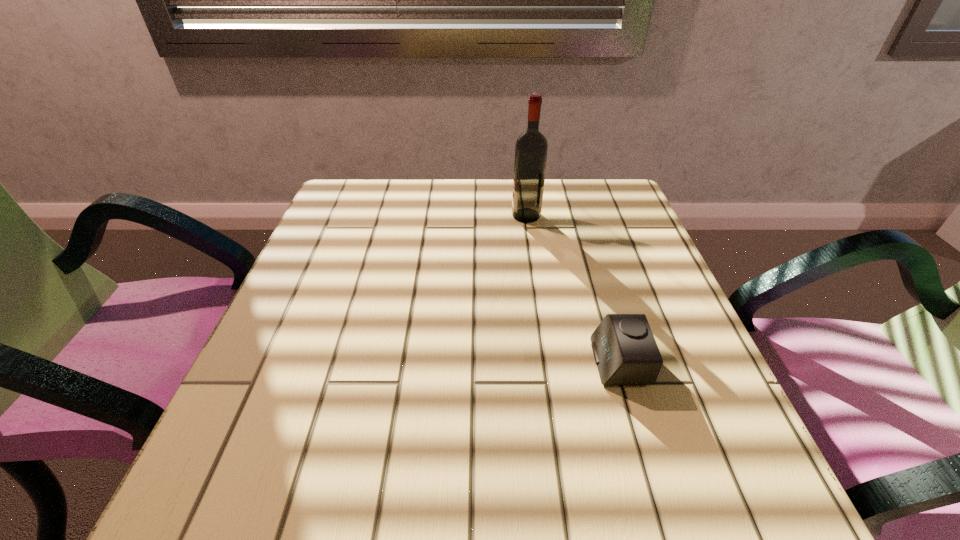
I want to click on alcohol, so click(x=531, y=148).

Where is `the left object`? This screenshot has width=960, height=540. the left object is located at coordinates (531, 148).

Where is `the right object`? the right object is located at coordinates (625, 351).

Where is `alarm clock`? alarm clock is located at coordinates (625, 351).

Locate an element on the screen. This screenshot has height=540, width=960. vacant area located on the front and back of the farther object is located at coordinates (368, 215).

This screenshot has height=540, width=960. What are the coordinates of `blank space located on the front and back of the farther object` in the screenshot? It's located at (433, 215).

Identify the location of free location located on the front and back of the farther object. (491, 215).

The image size is (960, 540). What are the coordinates of `vacant area situated on the front-facing side of the shorter object` in the screenshot? It's located at (368, 362).

Locate an element on the screen. The image size is (960, 540). vacant space located 0.400m on the front-facing side of the shorter object is located at coordinates (356, 362).

The image size is (960, 540). What are the coordinates of `vacant space located 0.270m on the front-facing side of the shorter object` in the screenshot? It's located at (434, 362).